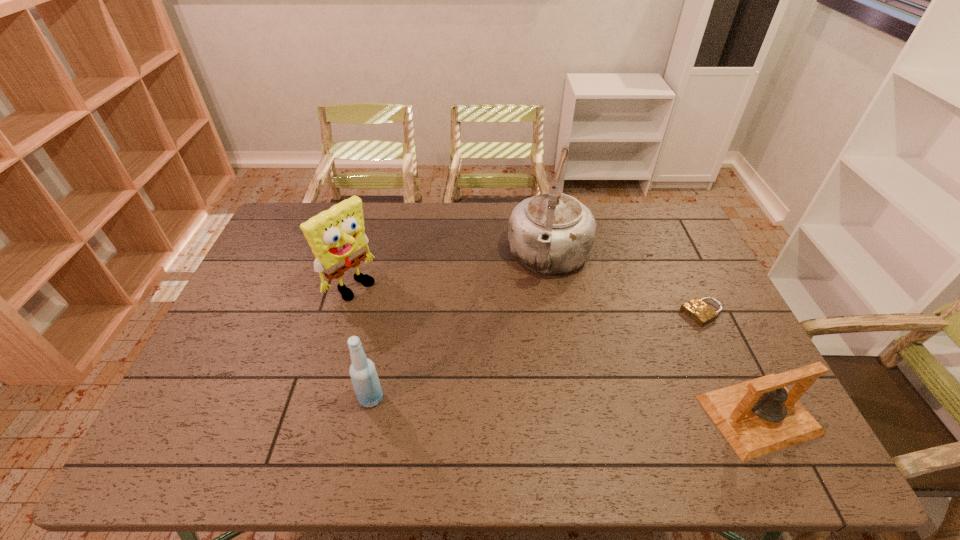
Locate an element on the screen. This screenshot has width=960, height=540. bottle present at the near edge is located at coordinates (363, 374).

You are a GUI agent. You are given a task and a screenshot of the screen. Output one action in this format:
    pyautogui.click(x=<x>, y=<y>)
    Task: Click on the bell located in the near edge section of the desktop
    Image resolution: width=960 pixels, height=540 pixels.
    Given the screenshot: What is the action you would take?
    pyautogui.click(x=759, y=416)

Locate an element on the screen. bell positioned at the right edge is located at coordinates (759, 416).

Where is `padlock that is positioned at the right edge`? The image size is (960, 540). padlock that is positioned at the right edge is located at coordinates (697, 310).

Find the location of `object that is positioned at the near right corner`. object that is positioned at the near right corner is located at coordinates (759, 416).

This screenshot has width=960, height=540. I want to click on free space at the far edge of the desktop, so click(x=401, y=232).

You are a GUI agent. You are given a task and a screenshot of the screen. Output one action in this format:
    pyautogui.click(x=<x>, y=<y>)
    Task: Click on the vacant area at the near edge
    The width and height of the screenshot is (960, 540).
    Given the screenshot: What is the action you would take?
    pyautogui.click(x=382, y=415)

This screenshot has width=960, height=540. I want to click on vacant space at the left edge of the desktop, so click(261, 326).

At what (x,y) coordinates should I click in order to perform the action: click on vacant space at the far left corner. Please return your answer as a coordinate pair (x, y). This screenshot has width=960, height=540. Looking at the image, I should click on (282, 215).

In the image, there is a desktop. Find the location of `vacant space at the near left corner`. vacant space at the near left corner is located at coordinates (204, 403).